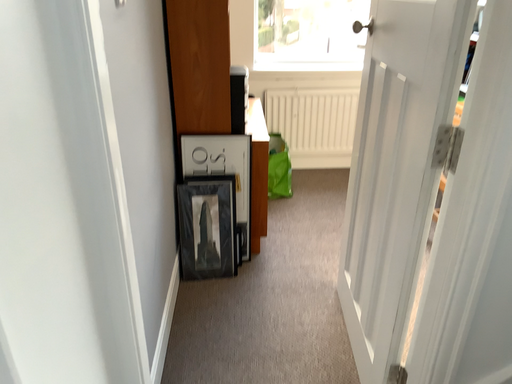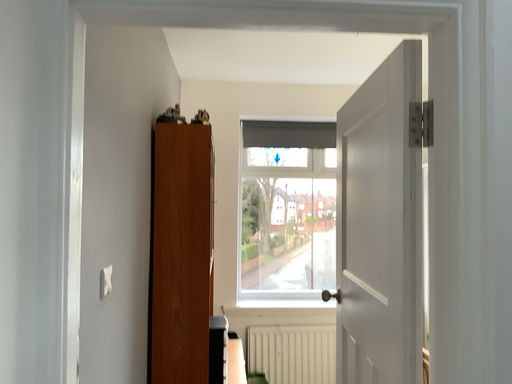
Question: How did the camera likely rotate when shooting the video?

Choices:
 (A) rotated upward
 (B) rotated downward

Answer: (A)